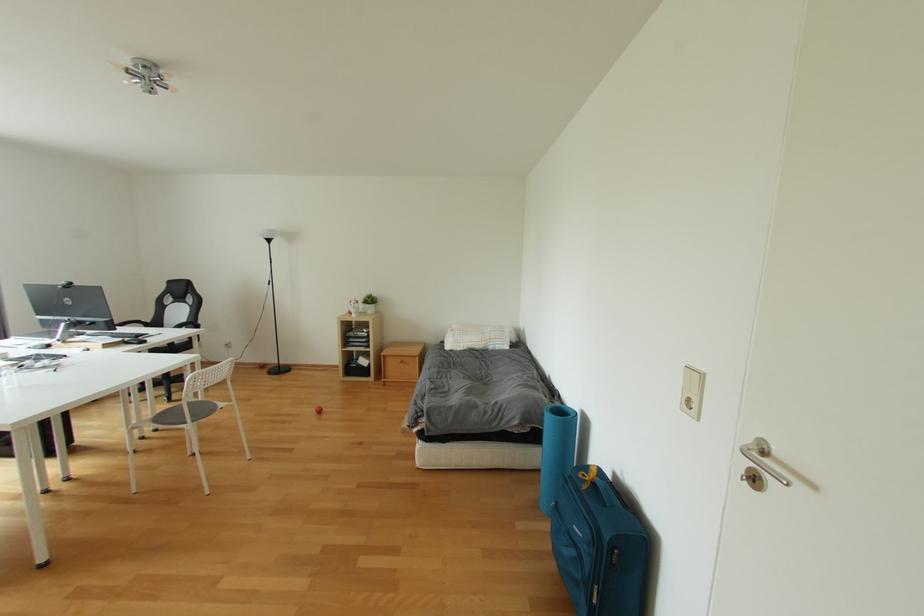
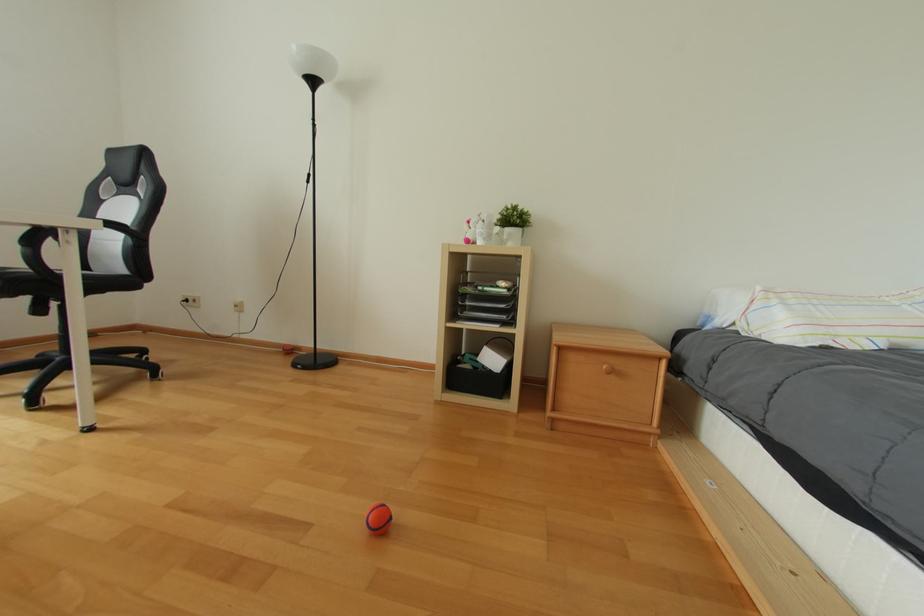
What movement of the cameraman would produce the second image?

The movement direction of the cameraman is left, forward.